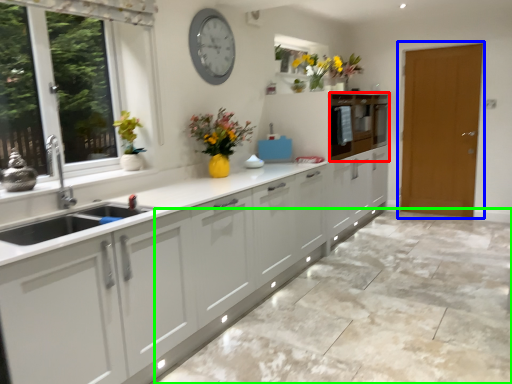
Question: Which object is the farthest from cabinetry (highlighted by a red box)? Choose among these: door (highlighted by a blue box) or granite (highlighted by a green box).

Choices:
 (A) door
 (B) granite

Answer: (B)